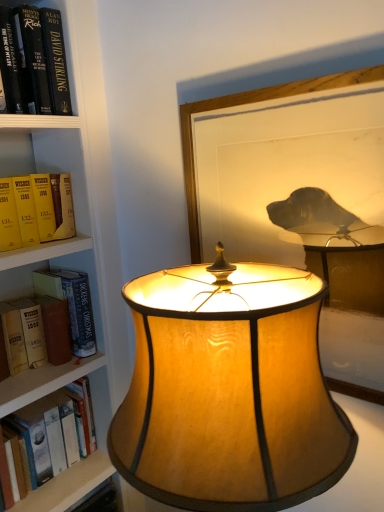
Question: Is hardcover book at left wider or thinner than matte gold lampshade at center?

Choices:
 (A) thin
 (B) wide

Answer: (A)

Question: From their relative heights in the image, would you say hardcover book at left is taller or shorter than matte gold lampshade at center?

Choices:
 (A) tall
 (B) short

Answer: (B)

Question: Which object is positioned farthest from the hardcover book at left?

Choices:
 (A) hardcover book at left
 (B) wooden framed picture at center
 (C) matte gold lampshade at center

Answer: (C)

Question: Considering the real-world distances, which object is closest to the matte gold lampshade at center?

Choices:
 (A) hardcover book at left
 (B) wooden framed picture at center
 (C) hardcover book at left

Answer: (B)